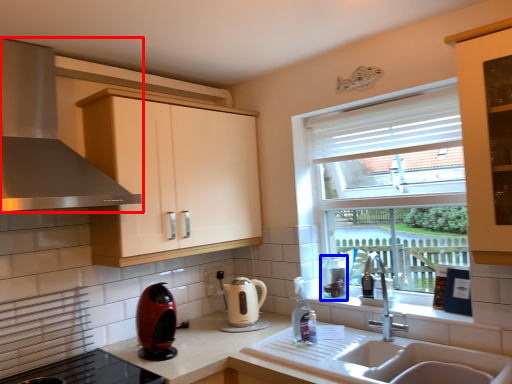
Question: Which point is closer to the camera, home appliance (highlighted by a red box) or appliance (highlighted by a blue box)?

Choices:
 (A) home appliance
 (B) appliance

Answer: (A)